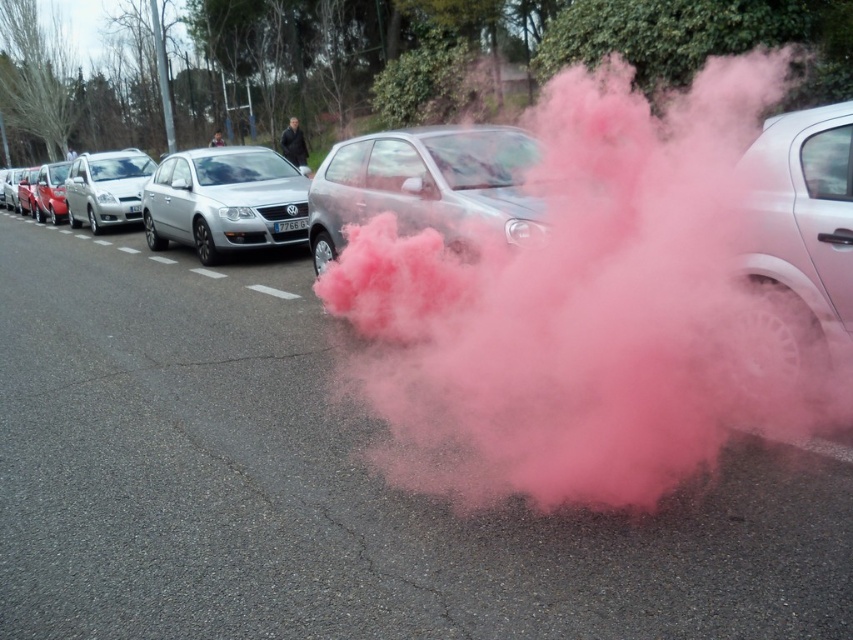
Does pink powder cloud at center have a larger size compared to satin silver car at center?

No.

Does pink powder cloud at center appear over satin silver car at center?

Actually, pink powder cloud at center is below satin silver car at center.

Who is more forward, (637, 115) or (241, 243)?

Positioned in front is point (637, 115).

This screenshot has height=640, width=853. Identify the location of pink powder cloud at center. (587, 310).

Does pink smoke at center have a lesser height compared to white metallic car at right?

In fact, pink smoke at center may be taller than white metallic car at right.

Does pink smoke at center lie behind white metallic car at right?

No, it is in front of white metallic car at right.

Who is more distant from viewer, (231, 362) or (785, 356)?

The point (231, 362) is more distant.

Where is `pink smoke at center`? This screenshot has height=640, width=853. pink smoke at center is located at coordinates (328, 484).

Which of these two, white metallic car at right or satin silver hatchback at left, stands taller?

With more height is satin silver hatchback at left.

How far apart are white metallic car at right and satin silver hatchback at left?

white metallic car at right is 15.90 meters away from satin silver hatchback at left.

This screenshot has width=853, height=640. In order to click on white metallic car at right in this screenshot , I will do `click(802, 241)`.

Locate an element on the screen. white metallic car at right is located at coordinates (802, 241).